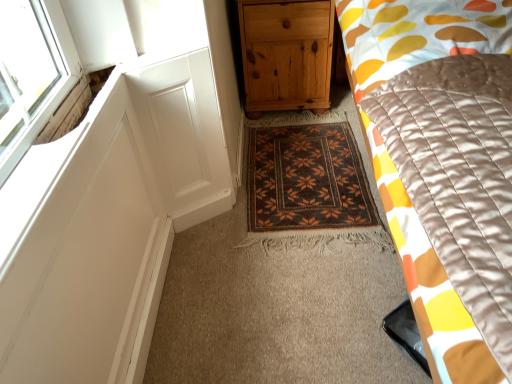
Question: Is natural wood chest of drawers at center taller or shorter than silky yellow-orange quilt at right?

Choices:
 (A) tall
 (B) short

Answer: (B)

Question: Looking at the image, does natural wood chest of drawers at center seem bigger or smaller compared to silky yellow-orange quilt at right?

Choices:
 (A) small
 (B) big

Answer: (A)

Question: Which object is positioned closest to the natural wood chest of drawers at center?

Choices:
 (A) brown woven mat at center
 (B) silky yellow-orange quilt at right

Answer: (A)

Question: Estimate the real-world distances between objects in this image. Which object is farther from the natural wood chest of drawers at center?

Choices:
 (A) brown woven mat at center
 (B) silky yellow-orange quilt at right

Answer: (B)